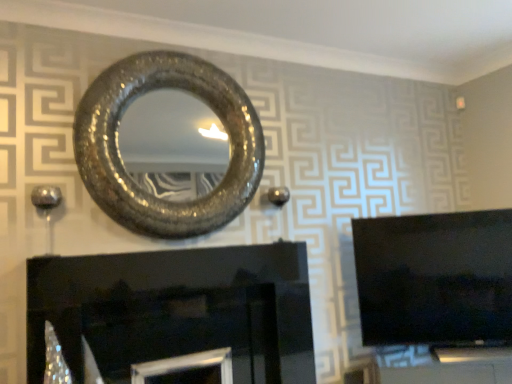
Question: Could you tell me if black glossy fireplace at lower center is turned towards black glossy tv at right?

Choices:
 (A) yes
 (B) no

Answer: (B)

Question: Is black glossy tv at right completely or partially inside black glossy fireplace at lower center?

Choices:
 (A) yes
 (B) no

Answer: (B)

Question: From the image's perspective, does black glossy fireplace at lower center appear higher than black glossy tv at right?

Choices:
 (A) no
 (B) yes

Answer: (A)

Question: Are black glossy fireplace at lower center and black glossy tv at right located far from each other?

Choices:
 (A) yes
 (B) no

Answer: (B)

Question: From a real-world perspective, is black glossy fireplace at lower center below black glossy tv at right?

Choices:
 (A) no
 (B) yes

Answer: (B)

Question: Is point (x=201, y=79) closer or farther from the camera than point (x=453, y=268)?

Choices:
 (A) closer
 (B) farther

Answer: (A)

Question: Relative to black glossy tv at right, is shiny metallic mirror at upper center in front or behind?

Choices:
 (A) front
 (B) behind

Answer: (A)

Question: Is shiny metallic mirror at upper center bigger or smaller than black glossy tv at right?

Choices:
 (A) small
 (B) big

Answer: (B)

Question: Do you think shiny metallic mirror at upper center is within black glossy tv at right, or outside of it?

Choices:
 (A) inside
 (B) outside

Answer: (B)

Question: From their relative heights in the image, would you say black glossy fireplace at lower center is taller or shorter than black glossy tv at right?

Choices:
 (A) tall
 (B) short

Answer: (B)

Question: Choose the correct answer: Is black glossy fireplace at lower center inside black glossy tv at right or outside it?

Choices:
 (A) outside
 (B) inside

Answer: (A)

Question: Is black glossy fireplace at lower center in front of or behind black glossy tv at right in the image?

Choices:
 (A) front
 (B) behind

Answer: (A)

Question: Is point (160, 284) positioned closer to the camera than point (446, 243)?

Choices:
 (A) farther
 (B) closer

Answer: (B)

Question: Considering their positions, is shiny metallic mirror at upper center located in front of or behind black glossy fireplace at lower center?

Choices:
 (A) front
 (B) behind

Answer: (B)

Question: Is shiny metallic mirror at upper center inside the boundaries of black glossy fireplace at lower center, or outside?

Choices:
 (A) outside
 (B) inside

Answer: (A)